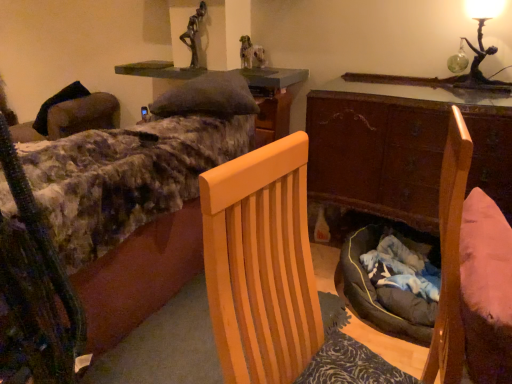
Question: Can you confirm if light wood chair at center is shorter than green felt cushion at upper center?

Choices:
 (A) no
 (B) yes

Answer: (A)

Question: Is light wood chair at center aimed at green felt cushion at upper center?

Choices:
 (A) no
 (B) yes

Answer: (A)

Question: From a real-world perspective, is light wood chair at center located higher than green felt cushion at upper center?

Choices:
 (A) no
 (B) yes

Answer: (A)

Question: Is light wood chair at center not inside green felt cushion at upper center?

Choices:
 (A) yes
 (B) no

Answer: (A)

Question: Is light wood chair at center smaller than green felt cushion at upper center?

Choices:
 (A) yes
 (B) no

Answer: (A)

Question: In terms of height, does fluffy fabric bed at upper left look taller or shorter compared to green felt cushion at upper center?

Choices:
 (A) tall
 (B) short

Answer: (A)

Question: Considering their positions, is fluffy fabric bed at upper left located in front of or behind green felt cushion at upper center?

Choices:
 (A) front
 (B) behind

Answer: (A)

Question: From a real-world perspective, is fluffy fabric bed at upper left positioned above or below green felt cushion at upper center?

Choices:
 (A) above
 (B) below

Answer: (B)

Question: Is fluffy fabric bed at upper left inside the boundaries of green felt cushion at upper center, or outside?

Choices:
 (A) outside
 (B) inside

Answer: (A)

Question: Is green felt cushion at upper center taller or shorter than green glass figure at upper right?

Choices:
 (A) tall
 (B) short

Answer: (A)

Question: From the image's perspective, relative to green glass figure at upper right, is green felt cushion at upper center above or below?

Choices:
 (A) below
 (B) above

Answer: (A)

Question: Is green felt cushion at upper center spatially inside green glass figure at upper right, or outside of it?

Choices:
 (A) inside
 (B) outside

Answer: (B)

Question: In the image, is green felt cushion at upper center positioned in front of or behind green glass figure at upper right?

Choices:
 (A) front
 (B) behind

Answer: (A)

Question: Considering the relative positions of green glass figure at upper right and wooden desk at center in the image provided, is green glass figure at upper right to the left or to the right of wooden desk at center?

Choices:
 (A) right
 (B) left

Answer: (A)

Question: Is green glass figure at upper right inside or outside of wooden desk at center?

Choices:
 (A) outside
 (B) inside

Answer: (A)